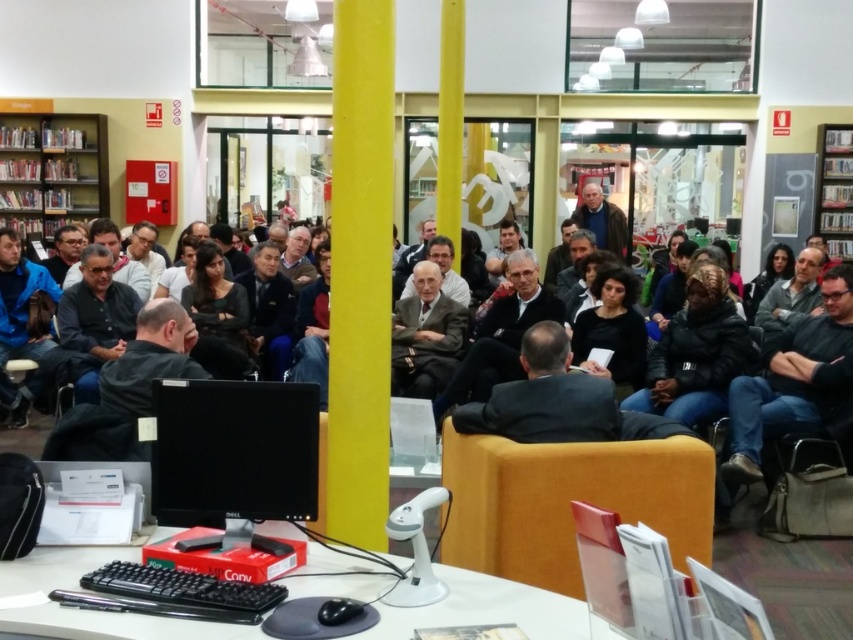
You are an attendee at this event and want to sit down. There is an orange fabric chair at center and a metallic silver bookshelf at upper right. Which object is closer to the floor?

The orange fabric chair at center is closer to the floor since it is located below the metallic silver bookshelf at upper right.

You are attending an event in this room and need to move from the orange fabric chair at center to the metallic silver bookshelf at upper right. In which direction should you move?

You should move to the right to reach the metallic silver bookshelf at upper right from the orange fabric chair at center since the orange fabric chair at center is to the left of the metallic silver bookshelf at upper right.